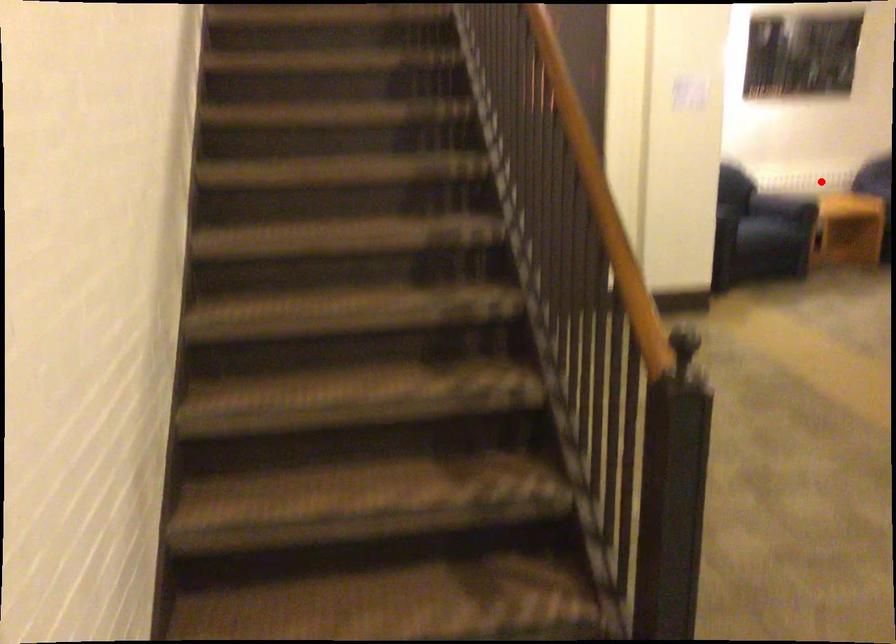
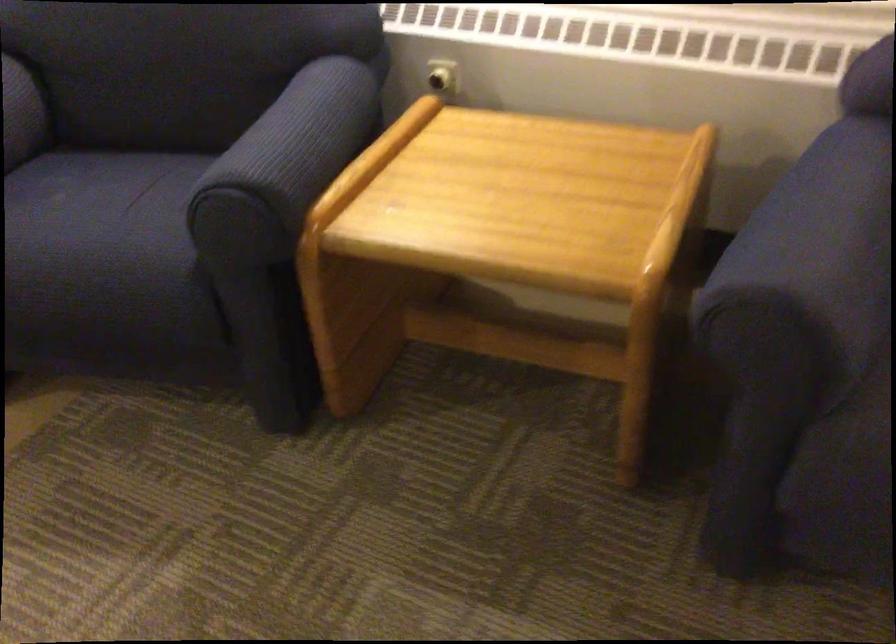
Question: I am providing you with two images of the same scene from different viewpoints. Image1 has a red point marked. In image2, the corresponding 3D location appears at what relative position? Reply with the corresponding letter.

Choices:
 (A) Closer
 (B) Farther

Answer: (A)